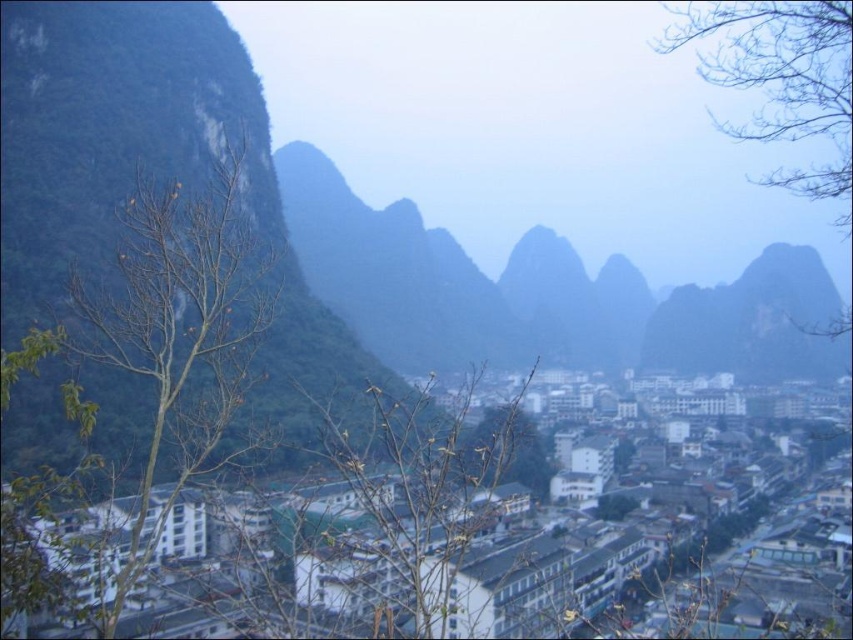
Can you confirm if white matte buildings at center is positioned below brown leafless tree at left?

Indeed, white matte buildings at center is positioned under brown leafless tree at left.

Does point (148, 608) lie in front of point (9, 608)?

No, it is behind (9, 608).

Describe the element at coordinates (422, 570) in the screenshot. I see `white matte buildings at center` at that location.

Identify the location of white matte buildings at center. The height and width of the screenshot is (640, 853). (422, 570).

Is the position of green rock at left less distant than that of brown leafless tree at left?

No, it is not.

Measure the distance between point (357,346) and camera.

Point (357,346) is 232.88 meters from camera.

Which is behind, point (248, 413) or point (27, 481)?

Positioned behind is point (248, 413).

What are the coordinates of `green rock at left` in the screenshot? It's located at (160, 182).

Is white matte buildings at center smaller than bare branches at upper right?

Correct, white matte buildings at center occupies less space than bare branches at upper right.

Who is shorter, white matte buildings at center or bare branches at upper right?

With less height is white matte buildings at center.

The width and height of the screenshot is (853, 640). In order to click on white matte buildings at center in this screenshot , I will do `click(422, 570)`.

Identify the location of white matte buildings at center. The width and height of the screenshot is (853, 640). (422, 570).